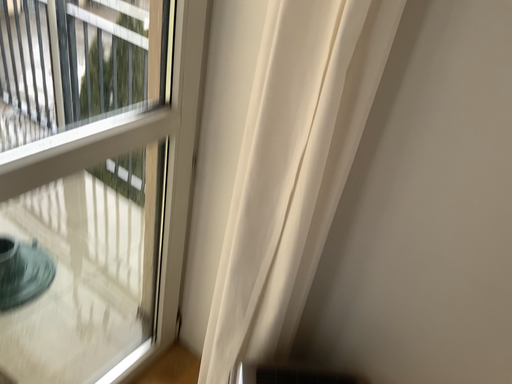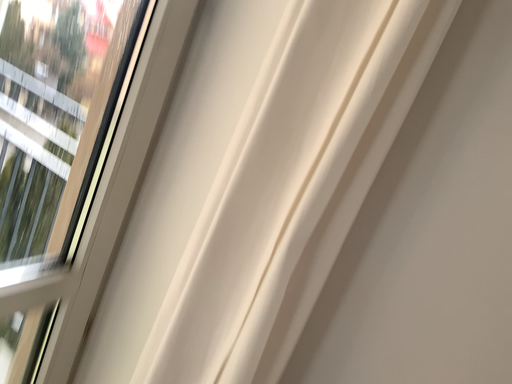
Question: How did the camera likely rotate when shooting the video?

Choices:
 (A) rotated downward
 (B) rotated upward

Answer: (B)